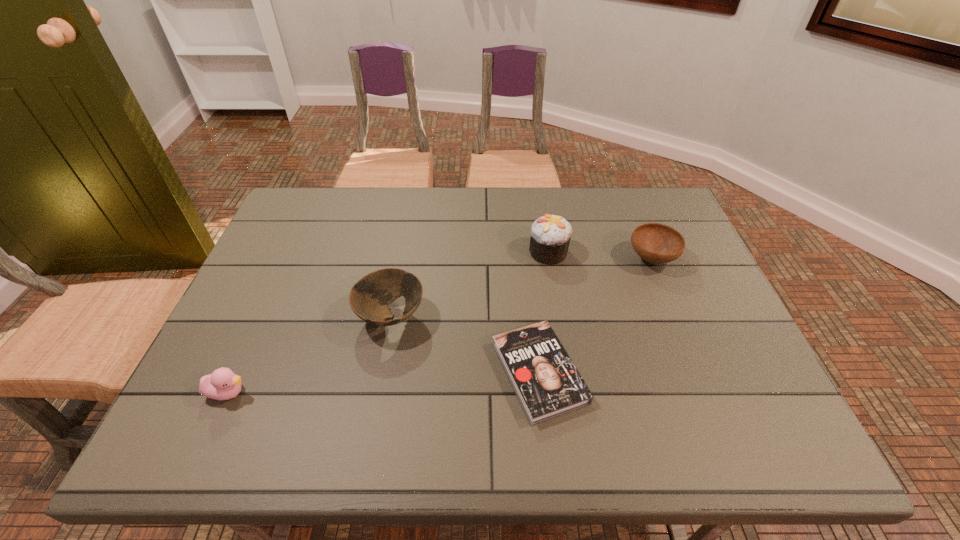
Where is `the tallest object`? The height and width of the screenshot is (540, 960). the tallest object is located at coordinates (550, 235).

Where is `the nearer bowl`? This screenshot has height=540, width=960. the nearer bowl is located at coordinates point(369,299).

At what (x,y) coordinates should I click in order to perform the action: click on the fourth object from right to left. Please return your answer as a coordinate pair (x, y). This screenshot has width=960, height=540. Looking at the image, I should click on (369, 299).

You are a GUI agent. You are given a task and a screenshot of the screen. Output one action in this format:
    pyautogui.click(x=<x>, y=<y>)
    Task: Click on the duckling
    
    Given the screenshot: What is the action you would take?
    pyautogui.click(x=222, y=384)

The image size is (960, 540). I want to click on the right bowl, so click(656, 243).

Where is `the rightmost object`? the rightmost object is located at coordinates 656,243.

You are a GUI agent. You are given a task and a screenshot of the screen. Output one action in this format:
    pyautogui.click(x=<x>, y=<y>)
    Task: Click on the book
    The width and height of the screenshot is (960, 540).
    Given the screenshot: What is the action you would take?
    pyautogui.click(x=547, y=384)

In order to click on vacant space situated on the left of the cupcake in this screenshot , I will do `click(487, 252)`.

Identify the location of free point located on the back of the fourth object from right to left. Image resolution: width=960 pixels, height=540 pixels. (402, 254).

Locate an element on the screen. This screenshot has height=540, width=960. free location located on the front-facing side of the leftmost object is located at coordinates (367, 392).